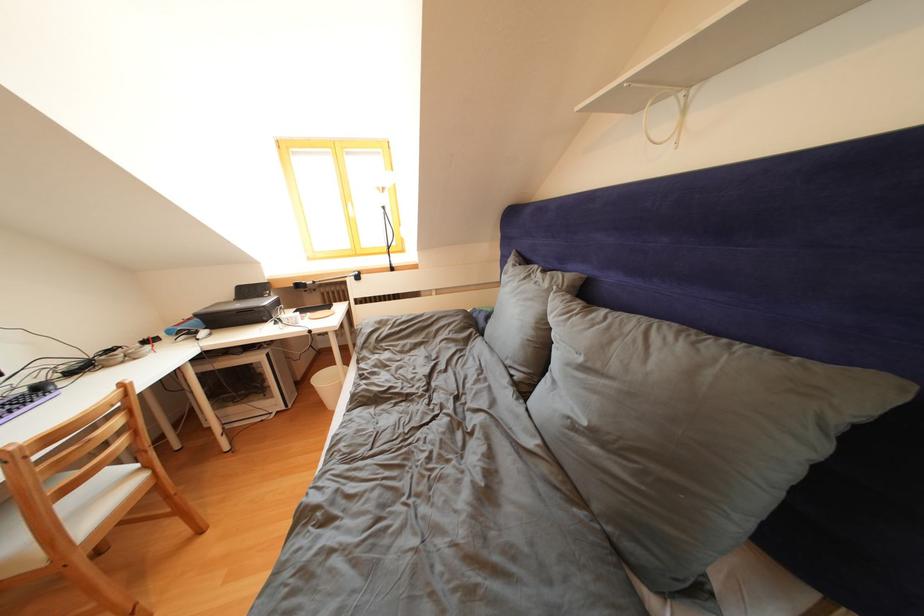
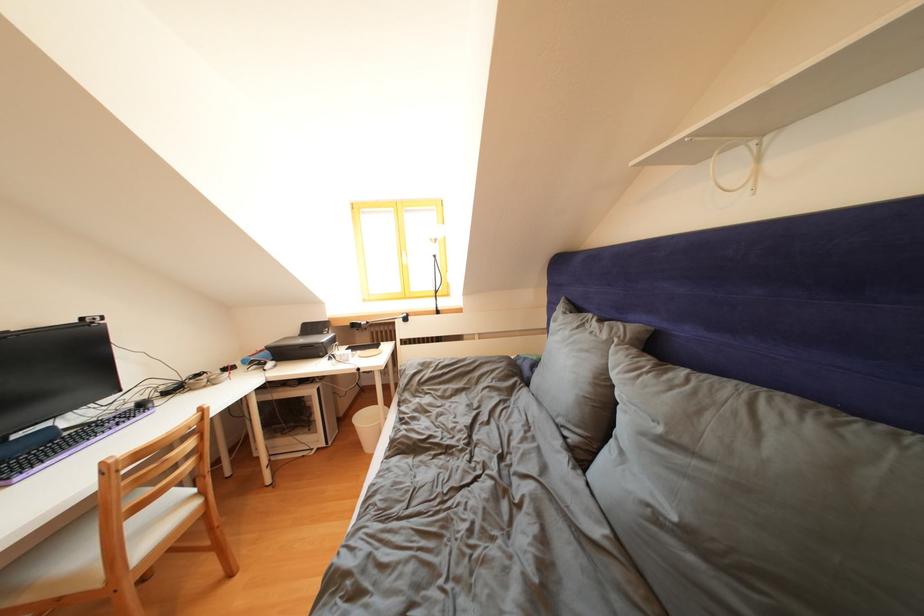
Locate, in the second image, the point that corresponds to (392,267) in the first image.

(438, 310)